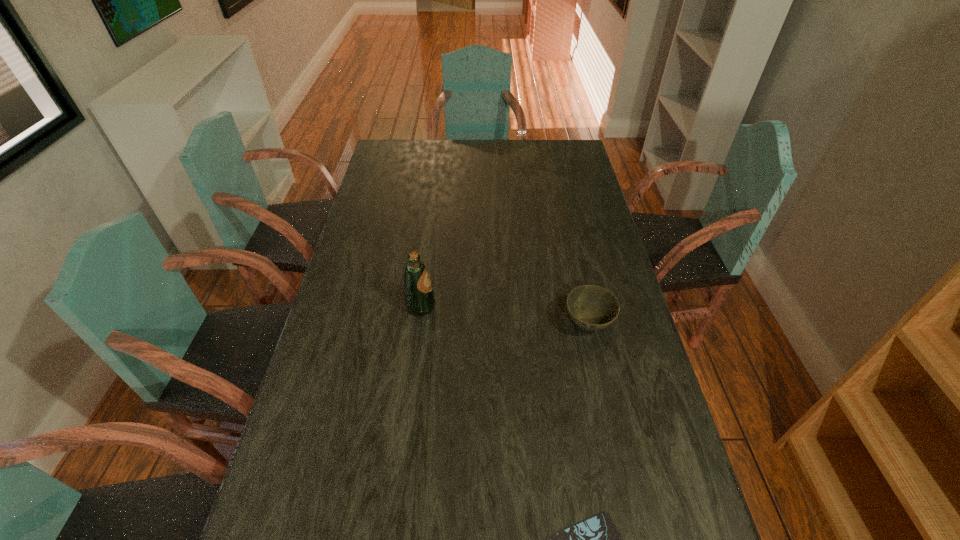
Find the location of a particular element. vacant space that is in between the bowl and the olive oil is located at coordinates (504, 315).

You are a GUI agent. You are given a task and a screenshot of the screen. Output one action in this format:
    pyautogui.click(x=<x>, y=<y>)
    Task: Click on the closest object to the leftmost object
    
    Given the screenshot: What is the action you would take?
    pyautogui.click(x=591, y=307)

Locate an element on the screen. The image size is (960, 540). object that ranks as the second closest to the leftmost object is located at coordinates (596, 539).

Where is `free spot that satisfies the following two spatial constraints: 1. on the front-facing side of the second tallest object; 2. on the right side of the tallest object`? free spot that satisfies the following two spatial constraints: 1. on the front-facing side of the second tallest object; 2. on the right side of the tallest object is located at coordinates (419, 324).

The height and width of the screenshot is (540, 960). Identify the location of vacant point that satisfies the following two spatial constraints: 1. on the back side of the second tallest object; 2. on the front-facing side of the olive oil. (584, 307).

Locate an element on the screen. The image size is (960, 540). vacant area that satisfies the following two spatial constraints: 1. on the front-facing side of the bowl; 2. on the right side of the leftmost object is located at coordinates (419, 324).

Find the location of `free location that satisfies the following two spatial constraints: 1. on the back side of the bowl; 2. on the front-facing side of the olive oil`. free location that satisfies the following two spatial constraints: 1. on the back side of the bowl; 2. on the front-facing side of the olive oil is located at coordinates (584, 307).

Identify the location of vacant region that satisfies the following two spatial constraints: 1. on the front-facing side of the olive oil; 2. on the right side of the second shortest object. (419, 324).

Locate an element on the screen. The height and width of the screenshot is (540, 960). blank area in the image that satisfies the following two spatial constraints: 1. on the front-facing side of the tallest object; 2. on the right side of the second shortest object is located at coordinates (419, 324).